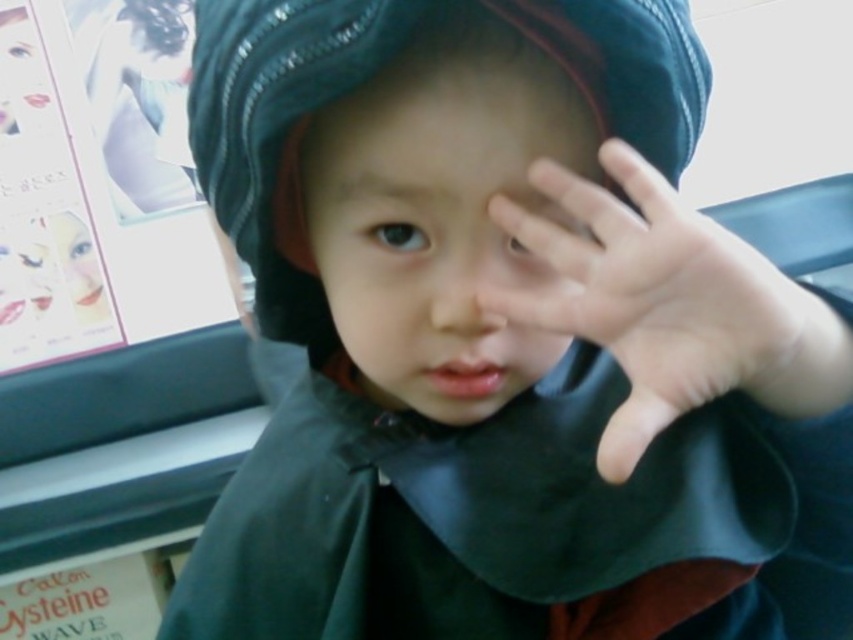
The scene shows a child with a dark green hooded garment and hat, standing near a window with a poster. You need to determine if the smooth skin face at center can be fully seen without obstruction from the smooth skin hand at upper right. Can it?

The smooth skin face at center is positioned over the smooth skin hand at upper right, meaning the hand is below the face. Since the hand is not in front of the face, the face can be fully seen without obstruction.

The scene shows a child with a denim hat at center and a smooth skin face at center. From the perspective of someone looking at the image, which object is positioned to the left?

The denim hat at center is positioned to the left of the smooth skin face at center.